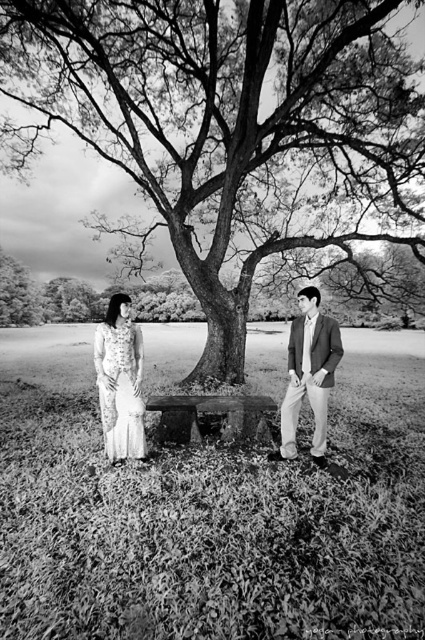
You are a photographer setting up for a portrait in this scene. You need to ensure that the white lace dress at left and the smooth beige suit at center are both visible in the frame. Given their height difference, which object should you adjust the camera angle to focus on to capture both effectively?

The white lace dress at left is shorter than the smooth beige suit at center. To capture both effectively, lower the camera angle slightly to ensure the shorter white lace dress at left is fully visible while still including the taller smooth beige suit at center in the frame.

Consider the image. You are a photographer setting up a camera to capture the scene. You need to ensure that both the white lace dress at left and the smooth beige suit at center are fully visible in the frame. Given their sizes, which object might require you to adjust the camera angle to accommodate its width?

The smooth beige suit at center requires adjusting the camera angle because it has a greater width than the white lace dress at left.